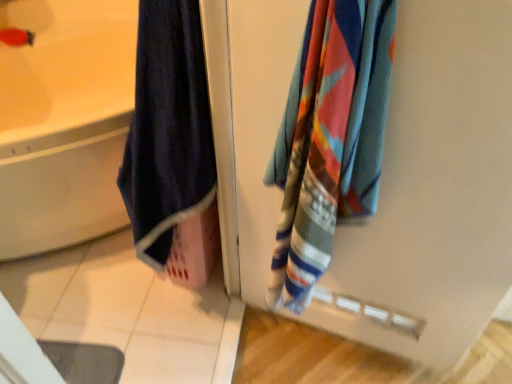
Question: Is matte white bathtub at left inside or outside of multicolored woven towel at right?

Choices:
 (A) outside
 (B) inside

Answer: (A)

Question: From a real-world perspective, is matte white bathtub at left above or below multicolored woven towel at right?

Choices:
 (A) above
 (B) below

Answer: (B)

Question: Is matte white bathtub at left taller or shorter than multicolored woven towel at right?

Choices:
 (A) tall
 (B) short

Answer: (B)

Question: Is multicolored woven towel at right to the left or to the right of matte white bathtub at left in the image?

Choices:
 (A) left
 (B) right

Answer: (B)

Question: From the image's perspective, is multicolored woven towel at right above or below matte white bathtub at left?

Choices:
 (A) below
 (B) above

Answer: (A)

Question: Is multicolored woven towel at right spatially inside matte white bathtub at left, or outside of it?

Choices:
 (A) inside
 (B) outside

Answer: (B)

Question: Relative to matte white bathtub at left, is multicolored woven towel at right in front or behind?

Choices:
 (A) behind
 (B) front

Answer: (B)